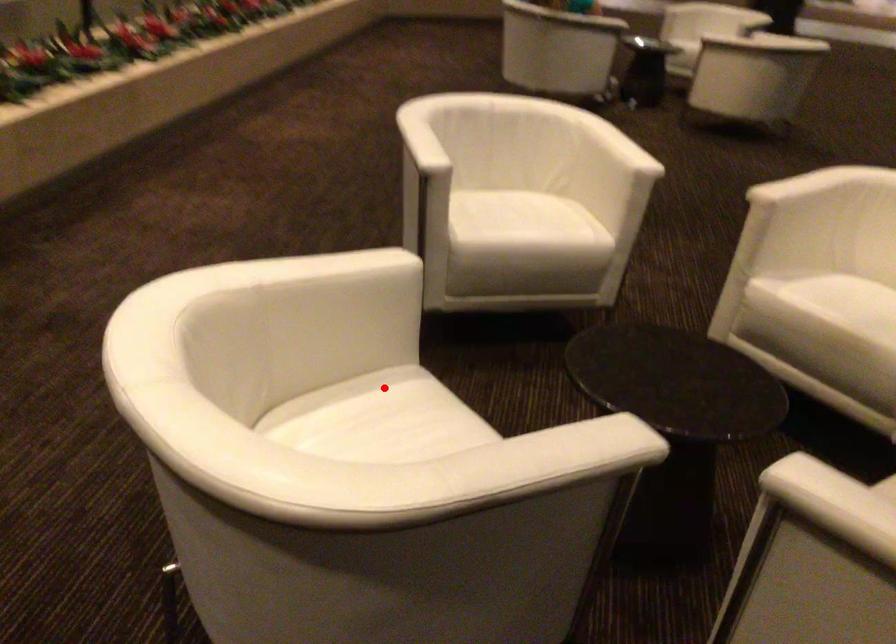
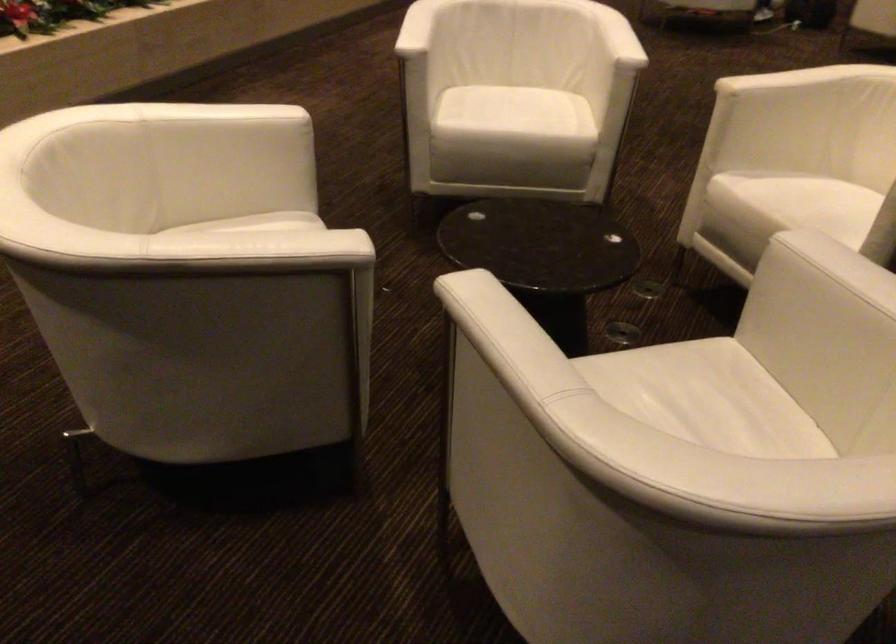
Question: I am providing you with two images of the same scene from different viewpoints. Given a red point in image1, look at the same physical point in image2. Is it:

Choices:
 (A) Closer to the viewpoint
 (B) Farther from the viewpoint

Answer: (B)